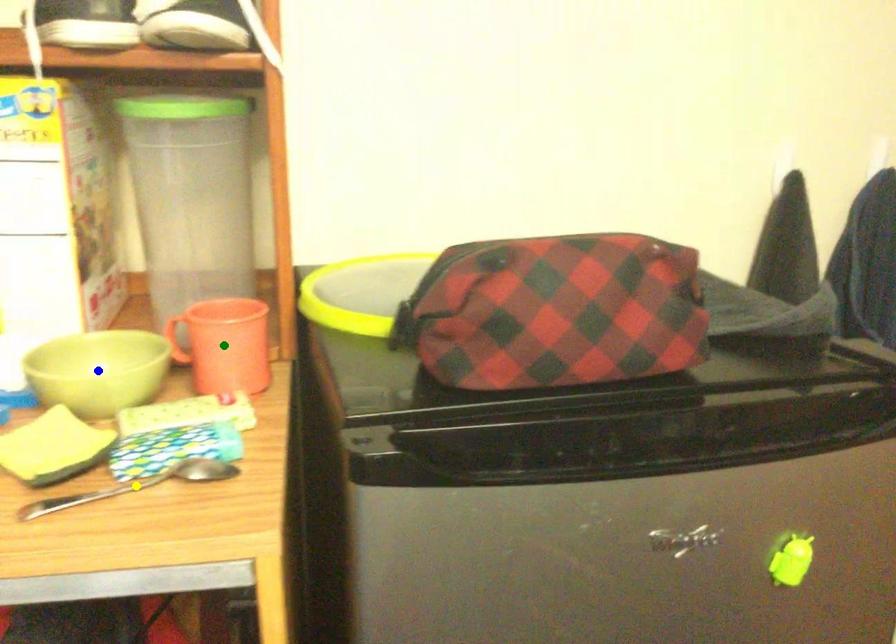
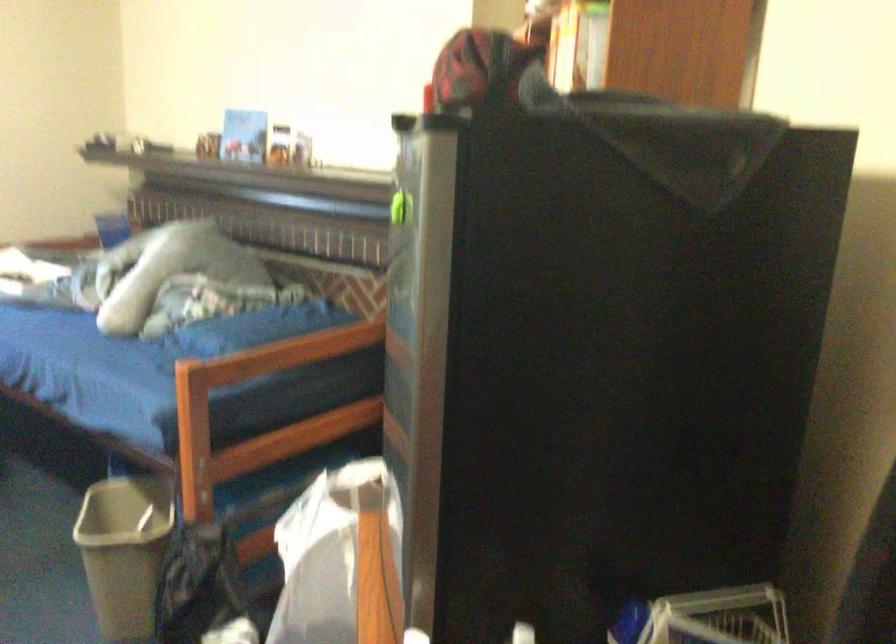
I am providing you with two images of the same scene from different viewpoints. Three points are marked in image1. Which point corresponds to a part or object that is occluded in image2?In image1, three points are marked. Which of them correspond to a part or object that is occluded in image2?Among the three points shown in image1, which one corresponds to a part or object that is no longer visible due to occlusion in image2?

yellow point, green point, blue point